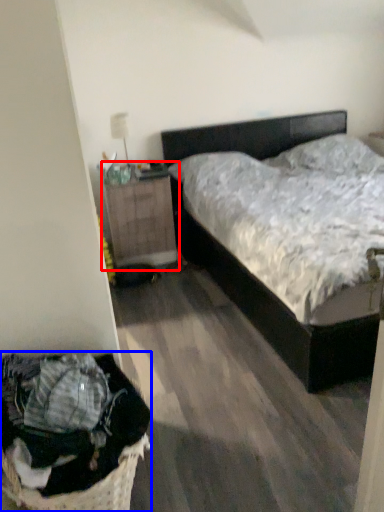
Question: Which object appears closest to the camera in this image, nightstand (highlighted by a red box) or laundry basket (highlighted by a blue box)?

Choices:
 (A) nightstand
 (B) laundry basket

Answer: (B)